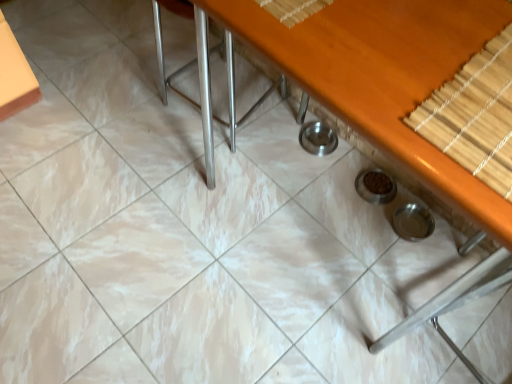
What is the approximate height of wooden table at center?

wooden table at center is 32.68 inches tall.

Describe the element at coordinates (206, 77) in the screenshot. I see `satin silver chair at center` at that location.

Locate an element on the screen. wooden table at center is located at coordinates (377, 76).

Is satin silver chair at center far away from wooden table at center?

No.

In terms of height, does satin silver chair at center look taller or shorter compared to wooden table at center?

Considering their sizes, satin silver chair at center has less height than wooden table at center.

Considering the relative sizes of satin silver chair at center and wooden table at center in the image provided, is satin silver chair at center wider than wooden table at center?

No.

Who is smaller, satin silver chair at center or wooden table at center?

satin silver chair at center is smaller.

Looking at this image, considering the sizes of objects bamboo mat at upper right and satin silver chair at center in the image provided, who is taller, bamboo mat at upper right or satin silver chair at center?

With more height is satin silver chair at center.

I want to click on chair behind the bamboo mat at upper right, so click(x=206, y=77).

From the image's perspective, between bamboo mat at upper right and satin silver chair at center, which one is located above?

satin silver chair at center.

Could you tell me if bamboo mat at upper right is turned towards satin silver chair at center?

No, bamboo mat at upper right does not turn towards satin silver chair at center.

Does point (505, 244) appear closer or farther from the camera than point (474, 70)?

Point (505, 244).

From the image's perspective, relative to bamboo mat at upper right, is wooden table at center above or below?

Clearly, from the image's perspective, wooden table at center is above bamboo mat at upper right.

In terms of height, does wooden table at center look taller or shorter compared to bamboo mat at upper right?

Clearly, wooden table at center is taller compared to bamboo mat at upper right.

Could bamboo mat at upper right be considered to be inside wooden table at center?

Yes, bamboo mat at upper right is inside wooden table at center.

Considering the positions of objects satin silver chair at center and bamboo mat at upper right in the image provided, who is in front, satin silver chair at center or bamboo mat at upper right?

bamboo mat at upper right is more forward.

From the image's perspective, is satin silver chair at center below bamboo mat at upper right?

Actually, satin silver chair at center appears above bamboo mat at upper right in the image.

Is satin silver chair at center to the right of bamboo mat at upper right from the viewer's perspective?

In fact, satin silver chair at center is to the left of bamboo mat at upper right.

How different are the orientations of satin silver chair at center and bamboo mat at upper right in degrees?

satin silver chair at center and bamboo mat at upper right are facing 97.1 degrees away from each other.

From a real-world perspective, which is physically above, wooden table at center or satin silver chair at center?

wooden table at center.

Can you confirm if wooden table at center is shorter than satin silver chair at center?

No.

Does wooden table at center turn towards satin silver chair at center?

No, wooden table at center does not turn towards satin silver chair at center.

Is wooden table at center inside the boundaries of satin silver chair at center, or outside?

wooden table at center is spatially situated outside satin silver chair at center.

How different are the orientations of bamboo mat at upper right and wooden table at center in degrees?

The angular difference between bamboo mat at upper right and wooden table at center is 90 degrees.

From a real-world perspective, is bamboo mat at upper right beneath wooden table at center?

No, from a real-world perspective, bamboo mat at upper right is not below wooden table at center.

Which of these two, bamboo mat at upper right or wooden table at center, is smaller?

With smaller size is bamboo mat at upper right.

You are a GUI agent. You are given a task and a screenshot of the screen. Output one action in this format:
    pyautogui.click(x=<x>, y=<y>)
    Task: Click on the chair on the left of wooden table at center
    This screenshot has height=384, width=512.
    Given the screenshot: What is the action you would take?
    pyautogui.click(x=206, y=77)

The height and width of the screenshot is (384, 512). I want to click on chair behind the bamboo mat at upper right, so coord(206,77).

Considering their positions, is satin silver chair at center positioned further to wooden table at center than bamboo mat at upper right?

Among the two, satin silver chair at center is located further to wooden table at center.

Considering their positions, is satin silver chair at center positioned closer to bamboo mat at upper right than wooden table at center?

The object closer to bamboo mat at upper right is wooden table at center.

Based on their spatial positions, is bamboo mat at upper right or satin silver chair at center closer to wooden table at center?

The object closer to wooden table at center is bamboo mat at upper right.

Looking at this image, from the image, which object appears to be farther from satin silver chair at center, wooden table at center or bamboo mat at upper right?

Among the two, bamboo mat at upper right is located further to satin silver chair at center.

Which object lies further to the anchor point satin silver chair at center, bamboo mat at upper right or wooden table at center?

The object further to satin silver chair at center is bamboo mat at upper right.

From the image, which object appears to be nearer to bamboo mat at upper right, wooden table at center or satin silver chair at center?

The object closer to bamboo mat at upper right is wooden table at center.

In order to click on table between satin silver chair at center and bamboo mat at upper right from left to right in this screenshot , I will do `click(377, 76)`.